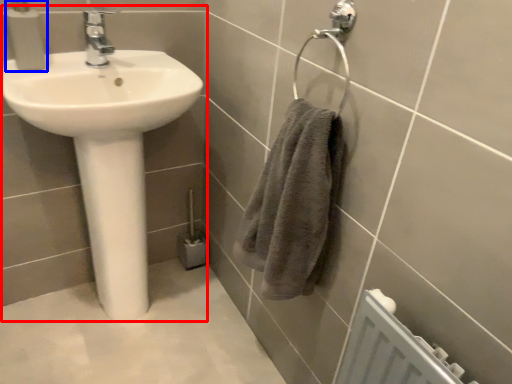
Question: Which object is further to the camera taking this photo, sink (highlighted by a red box) or soap dispenser (highlighted by a blue box)?

Choices:
 (A) sink
 (B) soap dispenser

Answer: (B)